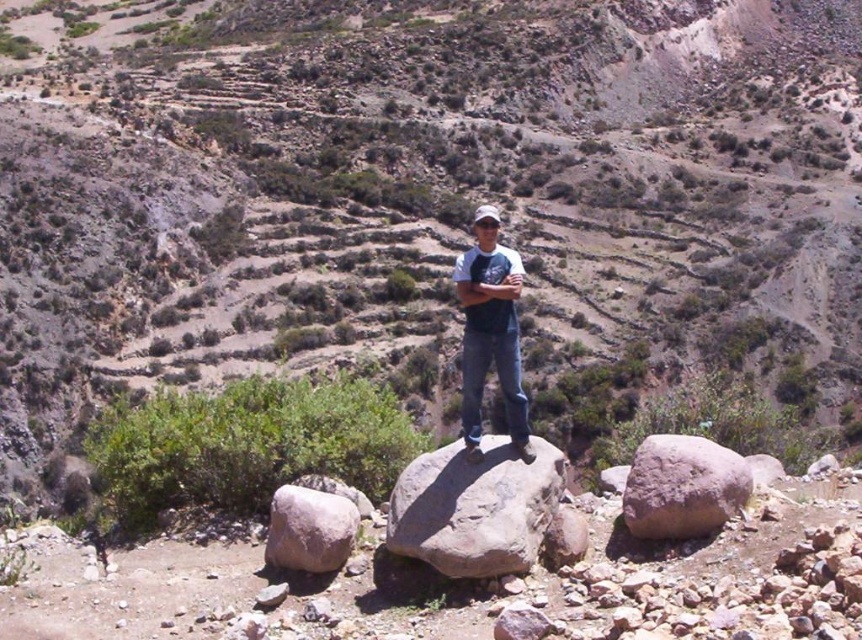
Find the location of a particular element. gray rough rock at center is located at coordinates (475, 508).

Looking at this image, is gray rough rock at center shorter than brown rough rock at center?

Incorrect, gray rough rock at center's height does not fall short of brown rough rock at center's.

Locate an element on the screen. gray rough rock at center is located at coordinates (475, 508).

Which is above, gray rough rock at center or denim jeans at center?

Positioned higher is denim jeans at center.

Does point (534, 435) lie in front of point (485, 234)?

No, (534, 435) is further to viewer.

Locate an element on the screen. gray rough rock at center is located at coordinates (475, 508).

Between gray rough rock at center and white matte baseball hat at center, which one is positioned lower?

gray rough rock at center

Does gray rough rock at center appear on the right side of white matte baseball hat at center?

Incorrect, gray rough rock at center is not on the right side of white matte baseball hat at center.

Who is more forward, (551, 452) or (486, 216)?

Point (551, 452)

Locate an element on the screen. This screenshot has width=862, height=640. gray rough rock at center is located at coordinates [475, 508].